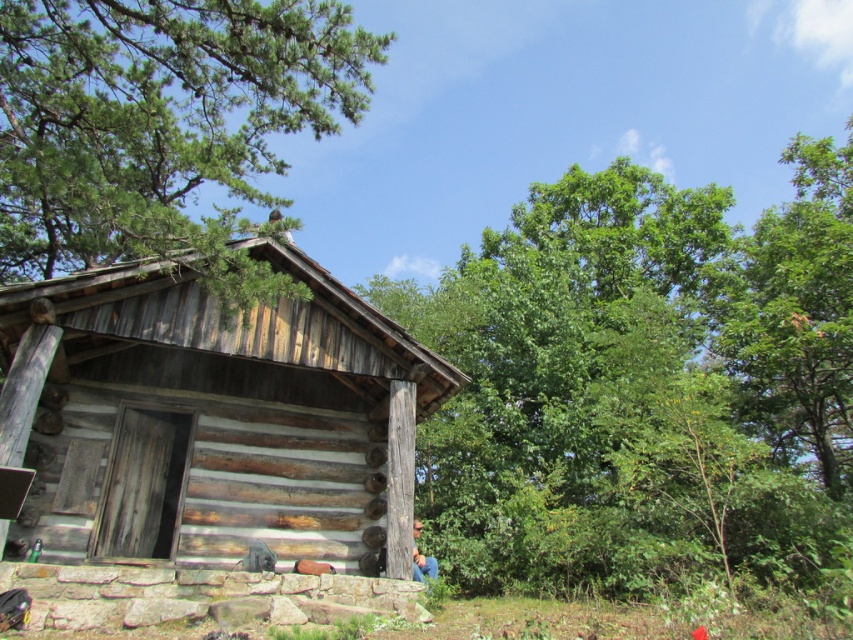
You are standing in the forest and see the weathered wood cabin at center and the green pine tree at upper left. Which object is positioned higher up in the image?

The green pine tree at upper left is positioned higher up in the image than the weathered wood cabin at center.

You are standing in front of the rustic log cabin and want to take a photo. There are two points marked in the scene, point 1 at coordinates point (532, 188) and point 2 at coordinates point (57, 150). Which point is closer to your camera when taking the photo?

Point (57, 150) is closer to the camera because point (532, 188) is further away from the camera than point (57, 150) according to the coordinates.